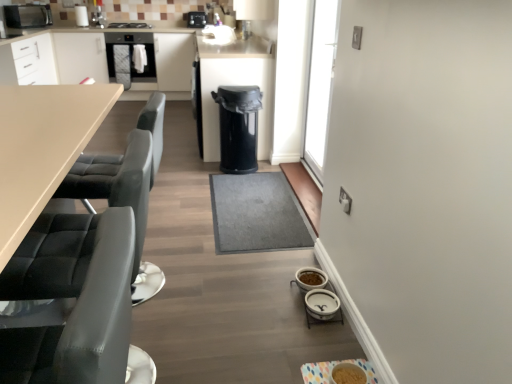
The width and height of the screenshot is (512, 384). Identify the location of free space between white ceramic bowls at lower right, acting as the 3th appliance starting from the right, and black plastic trash can at center, the 5th appliance positioned from the right. (266, 213).